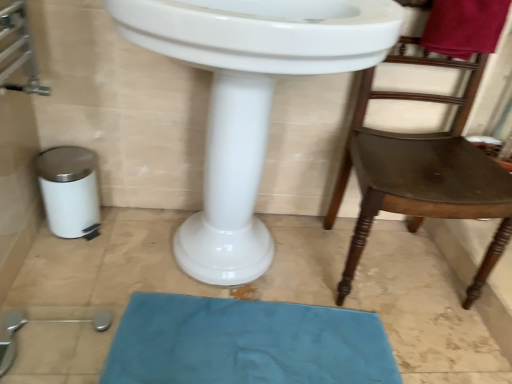
Image resolution: width=512 pixels, height=384 pixels. What do you see at coordinates (249, 99) in the screenshot? I see `white glossy sink at center` at bounding box center [249, 99].

The image size is (512, 384). Find the location of `blue fabric bath mat at lower center`. blue fabric bath mat at lower center is located at coordinates (246, 343).

Image resolution: width=512 pixels, height=384 pixels. What do you see at coordinates (422, 171) in the screenshot?
I see `brown wooden chair at right` at bounding box center [422, 171].

What is the approximate width of brown wooden chair at right?

17.39 inches.

This screenshot has width=512, height=384. I want to click on white glossy sink at center, so click(249, 99).

From a real-world perspective, is blue fabric bath mat at lower center physically below white glossy sink at center?

Yes, from a real-world perspective, blue fabric bath mat at lower center is below white glossy sink at center.

Looking at the image, does blue fabric bath mat at lower center seem bigger or smaller compared to white glossy sink at center?

Considering their sizes, blue fabric bath mat at lower center takes up less space than white glossy sink at center.

From the image's perspective, is blue fabric bath mat at lower center over white glossy sink at center?

No, from the image's perspective, blue fabric bath mat at lower center is not over white glossy sink at center.

Which object is closer to the camera, blue fabric bath mat at lower center or brown wooden chair at right?

brown wooden chair at right is more forward.

Could brown wooden chair at right be considered to be inside blue fabric bath mat at lower center?

No, brown wooden chair at right is not a part of blue fabric bath mat at lower center.

Which of these two, blue fabric bath mat at lower center or brown wooden chair at right, stands shorter?

blue fabric bath mat at lower center is shorter.

This screenshot has width=512, height=384. Identify the location of chair above the blue fabric bath mat at lower center (from a real-world perspective). (422, 171).

How distant is white glossy sink at center from blue fabric bath mat at lower center?

A distance of 15.41 inches exists between white glossy sink at center and blue fabric bath mat at lower center.

Does white glossy sink at center have a lesser height compared to blue fabric bath mat at lower center?

No.

Is white glossy sink at center thinner than blue fabric bath mat at lower center?

Incorrect, the width of white glossy sink at center is not less than that of blue fabric bath mat at lower center.

Is white glossy sink at center oriented away from blue fabric bath mat at lower center?

That's not correct — white glossy sink at center is not looking away from blue fabric bath mat at lower center.

Looking at this image, which is more to the right, brown wooden chair at right or white glossy sink at center?

From the viewer's perspective, brown wooden chair at right appears more on the right side.

From a real-world perspective, which is physically below, brown wooden chair at right or white glossy sink at center?

brown wooden chair at right.

Who is taller, brown wooden chair at right or white glossy sink at center?

With more height is white glossy sink at center.

How distant is brown wooden chair at right from white glossy sink at center?

brown wooden chair at right is 18.00 inches from white glossy sink at center.

How many degrees apart are the facing directions of brown wooden chair at right and blue fabric bath mat at lower center?

4.63 degrees.

Does brown wooden chair at right have a lesser height compared to blue fabric bath mat at lower center?

In fact, brown wooden chair at right may be taller than blue fabric bath mat at lower center.

From a real-world perspective, does brown wooden chair at right stand above blue fabric bath mat at lower center?

Indeed, from a real-world perspective, brown wooden chair at right stands above blue fabric bath mat at lower center.

Which object is wider, brown wooden chair at right or blue fabric bath mat at lower center?

Wider between the two is brown wooden chair at right.

From the image's perspective, is white glossy sink at center below brown wooden chair at right?

No, from the image's perspective, white glossy sink at center is not below brown wooden chair at right.

From a real-world perspective, is white glossy sink at center below brown wooden chair at right?

Incorrect, from a real-world perspective, white glossy sink at center is higher than brown wooden chair at right.

Considering the positions of objects white glossy sink at center and brown wooden chair at right in the image provided, who is in front, white glossy sink at center or brown wooden chair at right?

white glossy sink at center is closer to the camera.

Which is behind, point (360, 38) or point (463, 61)?

The point (463, 61) is farther.

Where is `bath mat located on the right of white glossy sink at center`? This screenshot has height=384, width=512. bath mat located on the right of white glossy sink at center is located at coordinates (246, 343).

In the image, there is a blue fabric bath mat at lower center. In order to click on chair above it (from the image's perspective) in this screenshot , I will do click(x=422, y=171).

Based on their spatial positions, is brown wooden chair at right or white glossy sink at center further from blue fabric bath mat at lower center?

Based on the image, brown wooden chair at right appears to be further to blue fabric bath mat at lower center.

Based on the photo, from the image, which object appears to be farther from white glossy sink at center, blue fabric bath mat at lower center or brown wooden chair at right?

brown wooden chair at right.

When comparing their distances from white glossy sink at center, does brown wooden chair at right or blue fabric bath mat at lower center seem further?

brown wooden chair at right.

Which object lies nearer to the anchor point blue fabric bath mat at lower center, white glossy sink at center or brown wooden chair at right?

white glossy sink at center lies closer to blue fabric bath mat at lower center than the other object.

Considering their positions, is blue fabric bath mat at lower center positioned closer to brown wooden chair at right than white glossy sink at center?

white glossy sink at center.

Looking at the image, which one is located further to brown wooden chair at right, white glossy sink at center or blue fabric bath mat at lower center?

The object further to brown wooden chair at right is blue fabric bath mat at lower center.

Where is `bath mat situated between white glossy sink at center and brown wooden chair at right from left to right`? The height and width of the screenshot is (384, 512). bath mat situated between white glossy sink at center and brown wooden chair at right from left to right is located at coordinates (246, 343).